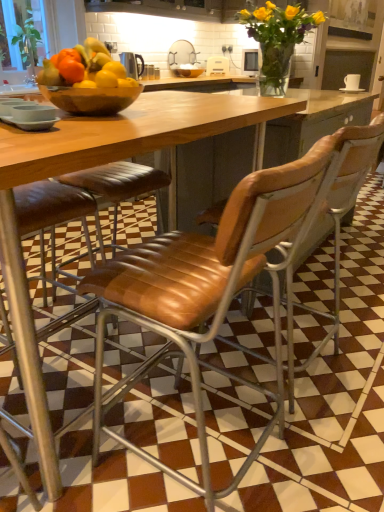
Question: Is wooden bowl at center to the left of metallic silver kettle at center from the viewer's perspective?

Choices:
 (A) yes
 (B) no

Answer: (B)

Question: Does wooden bowl at center come behind metallic silver kettle at center?

Choices:
 (A) no
 (B) yes

Answer: (A)

Question: From a real-world perspective, is wooden bowl at center over metallic silver kettle at center?

Choices:
 (A) yes
 (B) no

Answer: (B)

Question: Is wooden bowl at center to the right of metallic silver kettle at center from the viewer's perspective?

Choices:
 (A) yes
 (B) no

Answer: (A)

Question: Can you confirm if wooden bowl at center is thinner than metallic silver kettle at center?

Choices:
 (A) yes
 (B) no

Answer: (B)

Question: Is leather seat at center, the 2th chair positioned from the left, taller or shorter than yellow matte vase at upper center, the 1th flower in the back-to-front sequence?

Choices:
 (A) tall
 (B) short

Answer: (A)

Question: In terms of width, does leather seat at center, the 2th chair positioned from the left, look wider or thinner when compared to yellow matte vase at upper center, which is the 2th flower in bottom-to-top order?

Choices:
 (A) thin
 (B) wide

Answer: (B)

Question: Is leather seat at center, placed as the first chair when sorted from right to left, inside or outside of yellow matte vase at upper center, the 1th flower in the back-to-front sequence?

Choices:
 (A) inside
 (B) outside

Answer: (B)

Question: From the image's perspective, relative to yellow matte vase at upper center, which is the 2th flower in bottom-to-top order, is leather seat at center, placed as the first chair when sorted from right to left, above or below?

Choices:
 (A) below
 (B) above

Answer: (A)

Question: Is transparent glass bowl at center inside or outside of leather seat at center, the 2th chair positioned from the left?

Choices:
 (A) outside
 (B) inside

Answer: (A)

Question: From a real-world perspective, is transparent glass bowl at center positioned above or below leather seat at center, the 2th chair positioned from the left?

Choices:
 (A) below
 (B) above

Answer: (B)

Question: From the image's perspective, is transparent glass bowl at center located above or below leather seat at center, the 2th chair positioned from the left?

Choices:
 (A) above
 (B) below

Answer: (A)

Question: Is transparent glass bowl at center bigger or smaller than leather seat at center, the 2th chair positioned from the left?

Choices:
 (A) big
 (B) small

Answer: (B)

Question: Is yellow matte vase at upper center, placed as the 1th flower when sorted from top to bottom, wider or thinner than metallic silver kettle at center?

Choices:
 (A) thin
 (B) wide

Answer: (B)

Question: Is yellow matte vase at upper center, placed as the 1th flower when sorted from top to bottom, inside the boundaries of metallic silver kettle at center, or outside?

Choices:
 (A) inside
 (B) outside

Answer: (B)